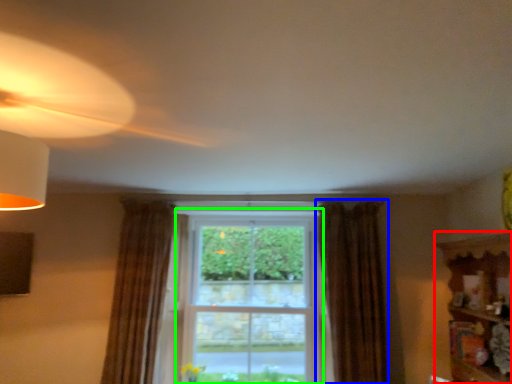
Question: Which object is positioned closest to shelf (highlighted by a red box)? Select from curtain (highlighted by a blue box) and bay window (highlighted by a green box).

Choices:
 (A) curtain
 (B) bay window

Answer: (A)